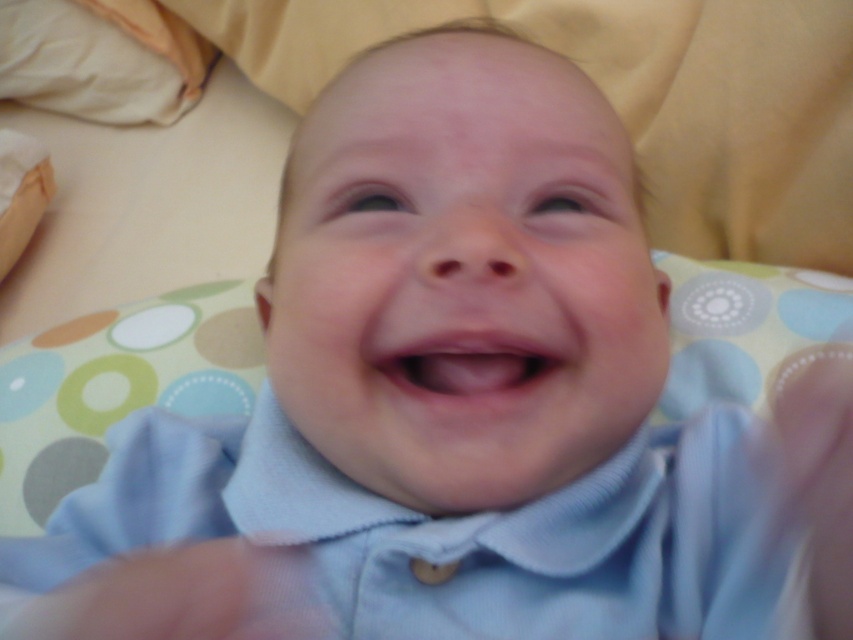
You are a photographer adjusting the camera focus on the baby. The camera has a focus point at point (102, 58). Which object should you focus on to capture the white soft pillow at upper left clearly?

The white soft pillow at upper left is located at point (102, 58), so you should focus on the white soft pillow at upper left to capture it clearly.

You are a photographer setting up a shoot with a baby. You have a light blue cotton shirt at center and a white soft pillow at upper left. The baby is lying on the pillow. To ensure the shirt is visible in the photo, which object should you position closer to the camera?

The light blue cotton shirt at center should be positioned closer to the camera since its width surpasses that of the white soft pillow at upper left, making it more prominent in the frame.

From the picture: You are a photographer setting up a shot of the baby in the image. You need to ensure that the light blue cotton shirt at center is in focus. Given that your camera has a depth of field that can sharply focus objects within 30 centimeters from the current focus point, should you adjust the focus closer or farther away from the camera?

The light blue cotton shirt at center is 31.82 centimeters away from the camera. Since the depth of field can only sharply focus within 30 centimeters from the focus point, the shirt is slightly beyond the optimal range. To ensure sharp focus, you should adjust the focus point slightly closer to the shirt, bringing it within the 30 cm threshold.